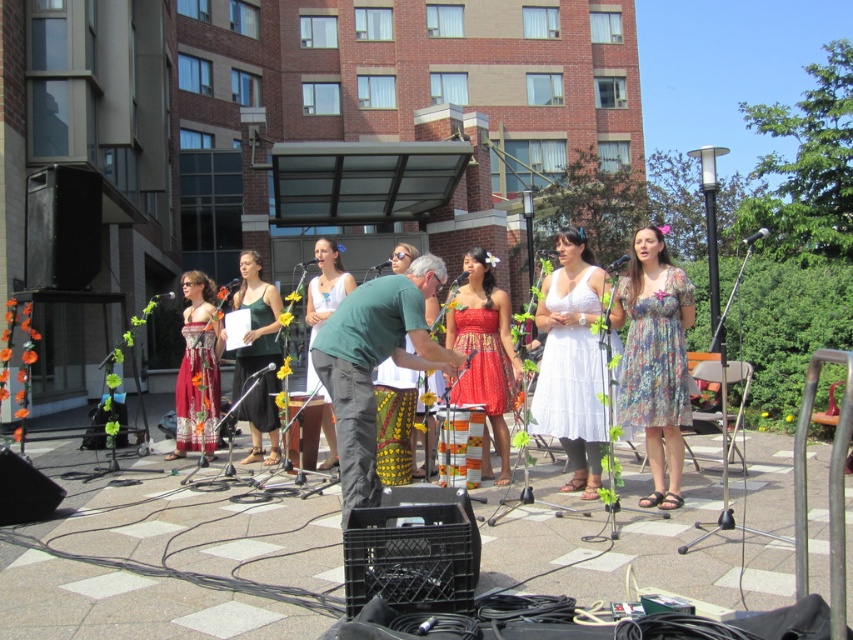
Question: Can you confirm if red satin dress at center is positioned above green cotton shirt at center?

Choices:
 (A) yes
 (B) no

Answer: (B)

Question: Among these points, which one is nearest to the camera?

Choices:
 (A) (329, 243)
 (B) (670, 289)
 (C) (473, 365)
 (D) (577, 436)

Answer: (B)

Question: Which of the following is the farthest from the observer?

Choices:
 (A) green cotton shirt at center
 (B) floral print dress at center
 (C) matte floral dress at center

Answer: (C)

Question: Which object appears farthest from the camera in this image?

Choices:
 (A) red satin dress at center
 (B) floral print dress at center
 (C) printed cotton dress at center

Answer: (A)

Question: Where is floral print dress at center located in relation to green cotton shirt at center in the image?

Choices:
 (A) below
 (B) above

Answer: (A)

Question: Does green fabric shirt at center lie in front of floral print dress at center?

Choices:
 (A) no
 (B) yes

Answer: (B)